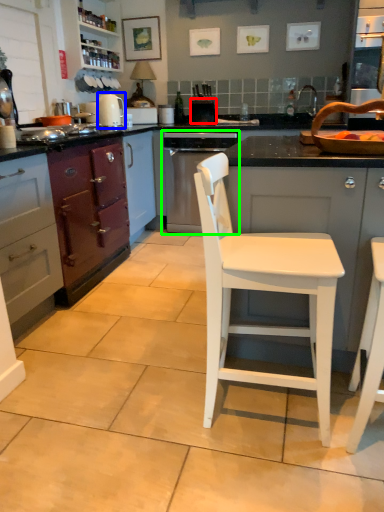
Question: Which is nearer to the appliance (highlighted by a red box)? kitchen appliance (highlighted by a blue box) or home appliance (highlighted by a green box).

Choices:
 (A) kitchen appliance
 (B) home appliance

Answer: (B)